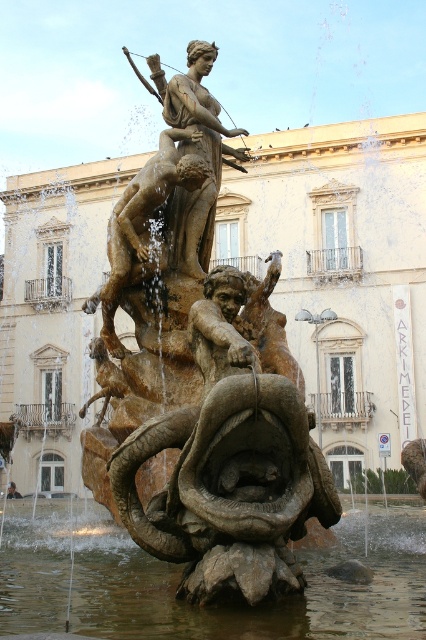
You are an architect designing a new plaza and want to place a bench for visitors to admire the translucent stone water at center and bronze statue at upper center. To ensure visitors can see both objects clearly, which one should the bench be placed closer to?

The bench should be placed closer to the translucent stone water at center because it has a lesser height compared to the bronze statue at upper center, allowing visitors to view both objects without obstruction.

Looking at the grand fountain sculpture in front of the classical building, you notice the translucent stone water at center and the bronze statue at upper center. Which object is positioned to the left of the other?

The translucent stone water at center is to the left of bronze statue at upper center.

You are an architect designing a new plaza and want to ensure that the bronze statue at upper center will not be submerged by the translucent stone water at center during heavy rain. Based on the current fountain design, is this a concern?

The translucent stone water at center is below the bronze statue at upper center, so during heavy rain, the water level might rise but the statue is positioned above the water, so it should remain visible and not submerged.